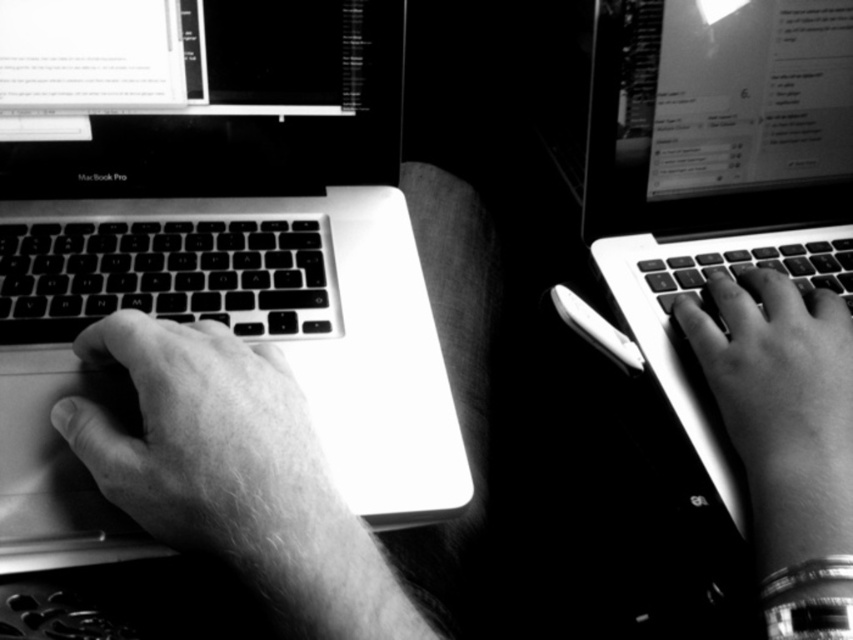
Is smooth skin hand at center below black matte keyboard at left?

Indeed, smooth skin hand at center is positioned under black matte keyboard at left.

Does smooth skin hand at center have a greater height compared to black matte keyboard at left?

Indeed, smooth skin hand at center has a greater height compared to black matte keyboard at left.

The height and width of the screenshot is (640, 853). I want to click on smooth skin hand at center, so click(235, 476).

Looking at this image, does metallic keyboard at center have a lesser width compared to smooth skin hand at left?

No, metallic keyboard at center is not thinner than smooth skin hand at left.

How far apart are metallic keyboard at center and smooth skin hand at left?

5.15 inches

Is point (213, 44) in front of point (202, 544)?

No, (213, 44) is further to viewer.

Identify the location of metallic keyboard at center. (227, 262).

Is metallic keyboard at right closer to the viewer compared to black matte keyboard at left?

Yes, metallic keyboard at right is closer to the viewer.

Is metallic keyboard at right bigger than black matte keyboard at left?

Yes, metallic keyboard at right is bigger than black matte keyboard at left.

Is point (645, 83) positioned behind point (234, 288)?

Yes, point (645, 83) is farther from viewer.

Find the location of a particular element. The height and width of the screenshot is (640, 853). metallic keyboard at right is located at coordinates click(715, 172).